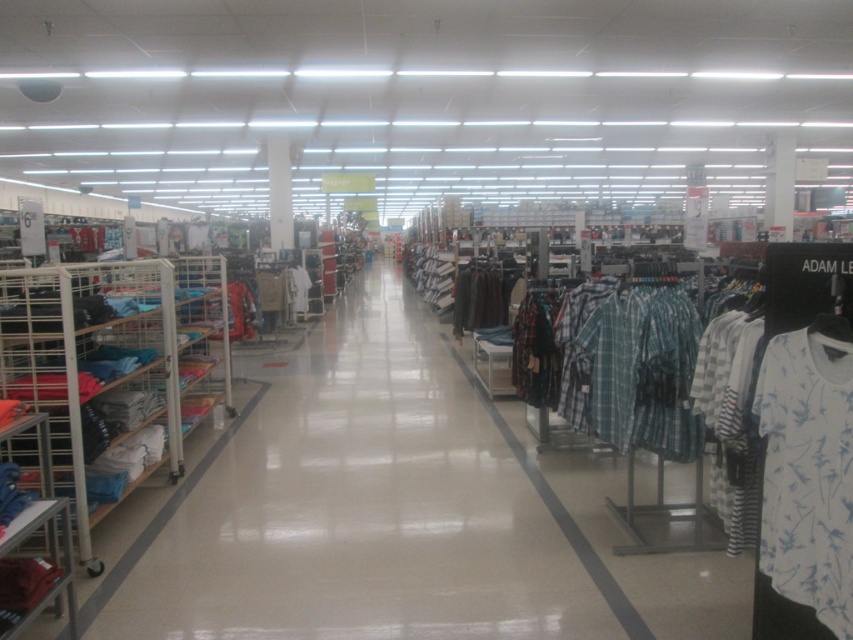
Question: Considering the real-world distances, which object is farthest from the white printed t-shirt at right?

Choices:
 (A) blue fabric shelf at left
 (B) matte blue shirts at center

Answer: (A)

Question: Which of the following is the farthest from the observer?

Choices:
 (A) white printed t-shirt at right
 (B) blue fabric shelf at left

Answer: (B)

Question: Does blue fabric shelf at left appear over white printed t-shirt at right?

Choices:
 (A) no
 (B) yes

Answer: (B)

Question: Which point is closer to the camera?

Choices:
 (A) (799, 540)
 (B) (561, 548)

Answer: (A)

Question: In this image, where is matte blue shirts at center located relative to white printed t-shirt at right?

Choices:
 (A) above
 (B) below

Answer: (B)

Question: From the image, what is the correct spatial relationship of matte blue shirts at center in relation to white printed t-shirt at right?

Choices:
 (A) left
 (B) right

Answer: (A)